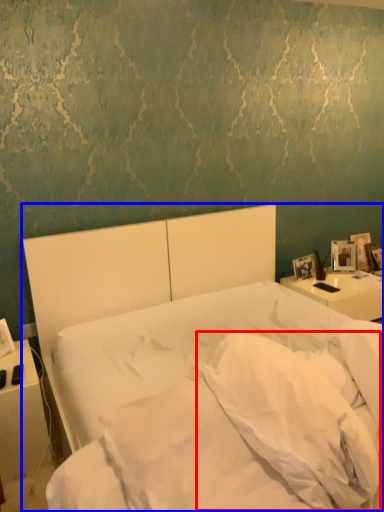
Question: Among these objects, which one is nearest to the camera, pillow (highlighted by a red box) or bed (highlighted by a blue box)?

Choices:
 (A) pillow
 (B) bed

Answer: (B)